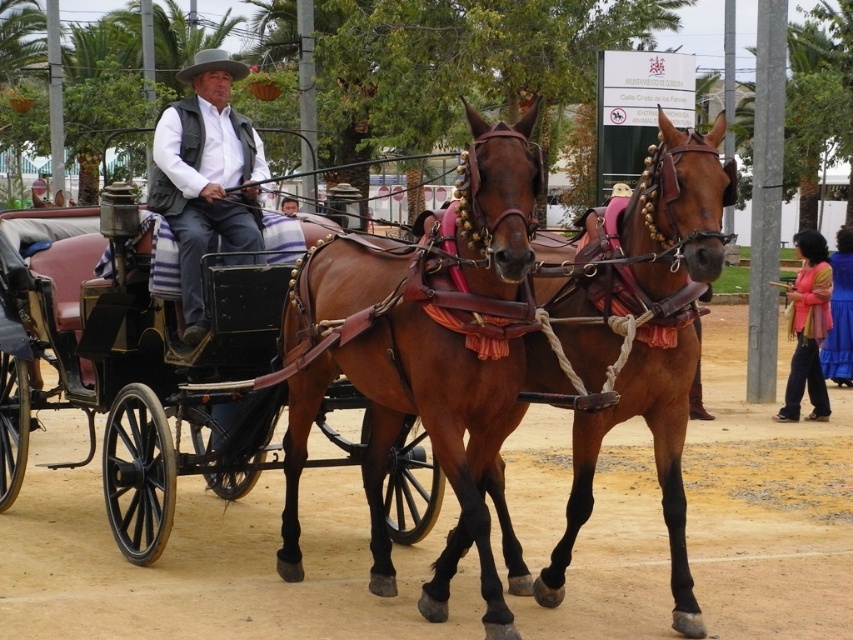
You are a photographer planning to take a photo of the matte black vest at center and the blue satin dress at lower right. Since you want both to be clearly visible, which object should you focus on first to ensure proper focus, considering their sizes?

The matte black vest at center is bigger than the blue satin dress at lower right, so focusing on the larger object first will ensure both are in focus as it requires more attention due to its size.

You are a photographer positioned at the front of the scene. You want to take a photo of the blue satin dress at lower right without the brown glossy horse at center blocking it. What should you do?

The brown glossy horse at center is in front of the blue satin dress at lower right, so you should move to the side of the horse to capture the dress without obstruction.

You are standing in the park and see the horse carriage. There are two points marked in the image. The first point is at coordinate point (469, 186) and the second point is at coordinate point (827, 403). Which point is closer to you?

Point (469, 186) is closer to the camera than point (827, 403), so the first point is closer to you.